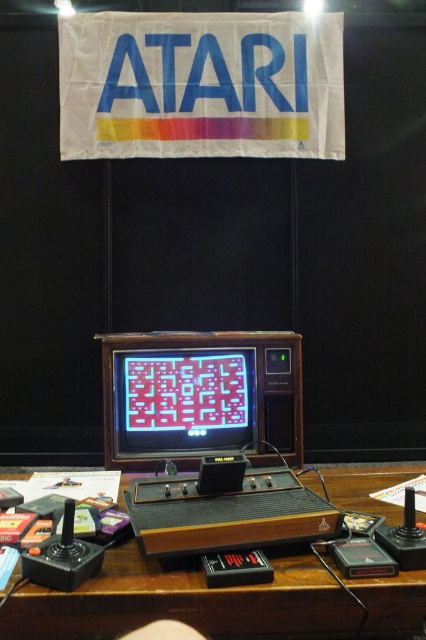
Between point (183, 595) and point (120, 346), which one is positioned in front?

Point (183, 595) is more forward.

Who is lower down, brown wood table at center or matte plastic monitor at center?

brown wood table at center

Which is in front, point (296, 634) or point (138, 385)?

Point (296, 634)

Identify the location of brown wood table at center. Image resolution: width=426 pixels, height=640 pixels. (184, 602).